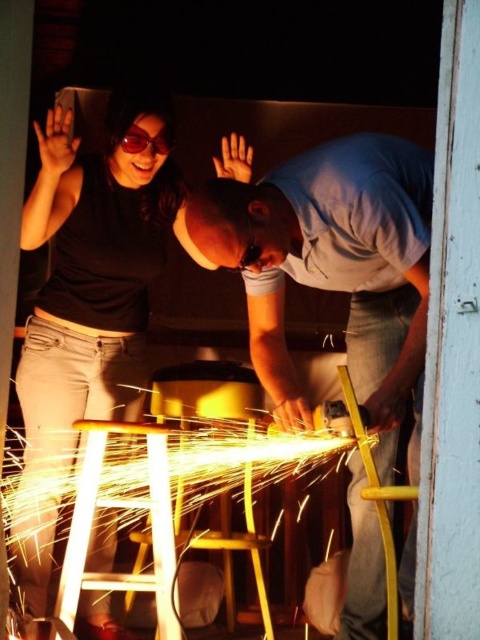
In the image, you see a matte gray shirt at center and a black matte shirt at upper left. Which one is positioned more to the right side of the image?

The matte gray shirt at center is positioned more to the right side of the image than the black matte shirt at upper left.

You are standing in the room where the welding activity is happening. You see the point at coordinates (297, 172). Can you reach this point with your outstretched hand if you are 1.6 meters tall?

The point at coordinates (297, 172) is 1.87 meters away from the camera. Since you are 1.6 meters tall, your outstretched hand can reach up to approximately 1.8 meters. The distance to the point is slightly beyond your reach, so you might need to take a step forward or use a tool to reach it.